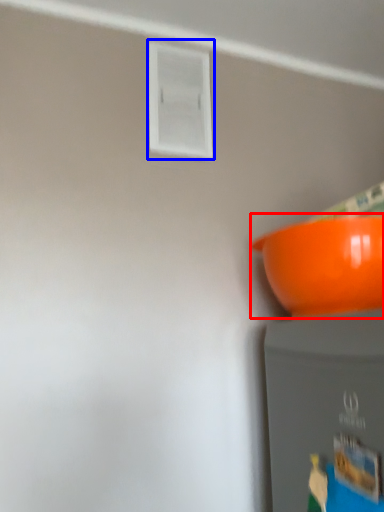
Question: Among these objects, which one is nearest to the camera, bowl (highlighted by a red box) or window (highlighted by a blue box)?

Choices:
 (A) bowl
 (B) window

Answer: (A)